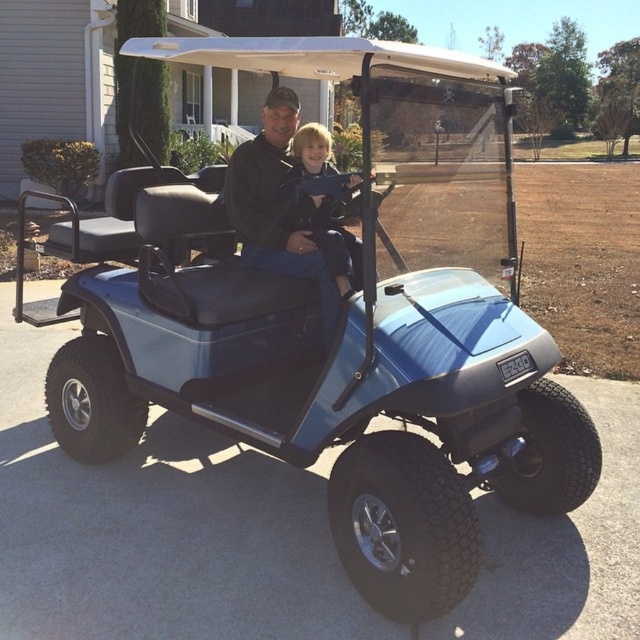
You are a photographer taking a picture of the black matte jacket at center and the blonde hair boy at center. Which object is taller in the photo?

The black matte jacket at center is taller than the blonde hair boy at center.

You are a photographer trying to frame a shot of the black matte jacket at center and the blonde hair boy at center. Which object is wider?

The black matte jacket at center is wider than the blonde hair boy at center.